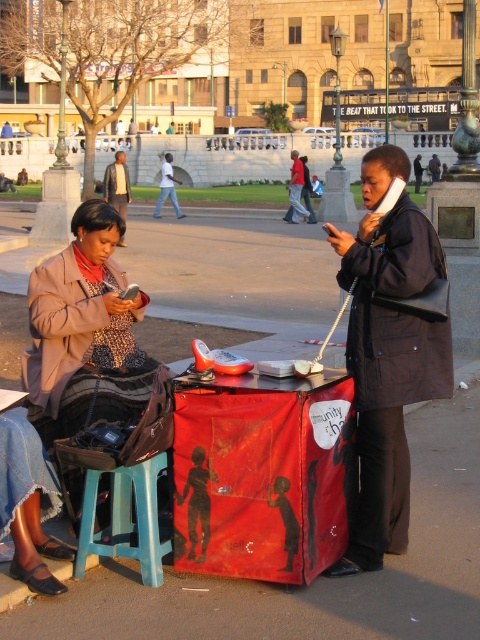
Can you confirm if matte black coat at center is positioned below matte brown coat at left?

No, matte black coat at center is not below matte brown coat at left.

Which is more to the right, matte black coat at center or matte brown coat at left?

From the viewer's perspective, matte black coat at center appears more on the right side.

This screenshot has height=640, width=480. What do you see at coordinates (387, 353) in the screenshot?
I see `matte black coat at center` at bounding box center [387, 353].

Locate an element on the screen. matte black coat at center is located at coordinates (387, 353).

Is matte black coat at center above dark brown leather jacket at center?

No.

Between point (427, 353) and point (115, 173), which one is positioned behind?

The point (115, 173) is more distant.

Does point (398, 365) come farther from viewer compared to point (130, 202)?

That is False.

The image size is (480, 640). Identify the location of matte black coat at center. (387, 353).

Is matte black coat at center wider than blue plastic stool at lower left?

In fact, matte black coat at center might be narrower than blue plastic stool at lower left.

Can you confirm if matte black coat at center is positioned below blue plastic stool at lower left?

No.

At what (x,y) coordinates should I click in order to perform the action: click on matte black coat at center. Please return your answer as a coordinate pair (x, y). Looking at the image, I should click on (387, 353).

You are a GUI agent. You are given a task and a screenshot of the screen. Output one action in this format:
    pyautogui.click(x=<x>, y=<y>)
    Task: Click on the matte black coat at center
    The height and width of the screenshot is (640, 480).
    Given the screenshot: What is the action you would take?
    pyautogui.click(x=387, y=353)